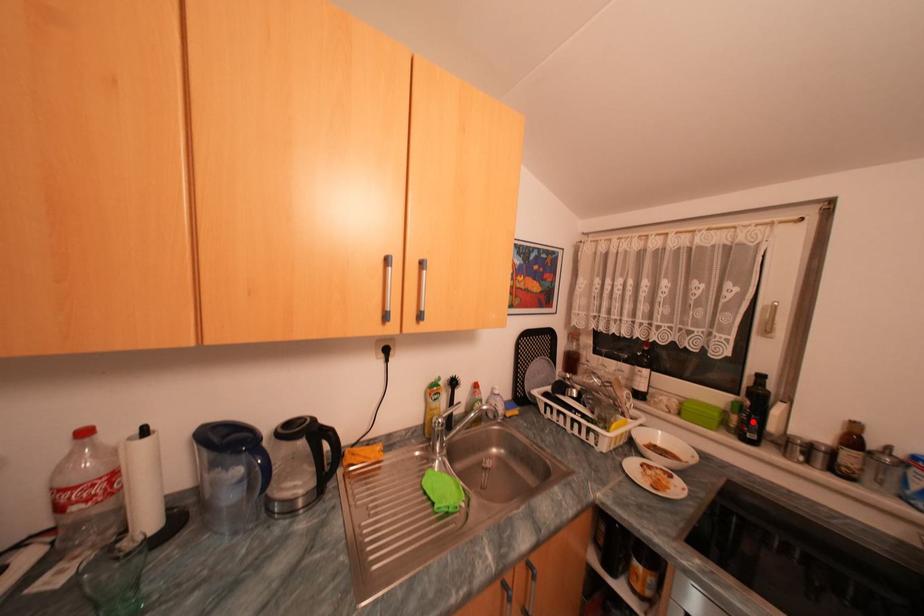
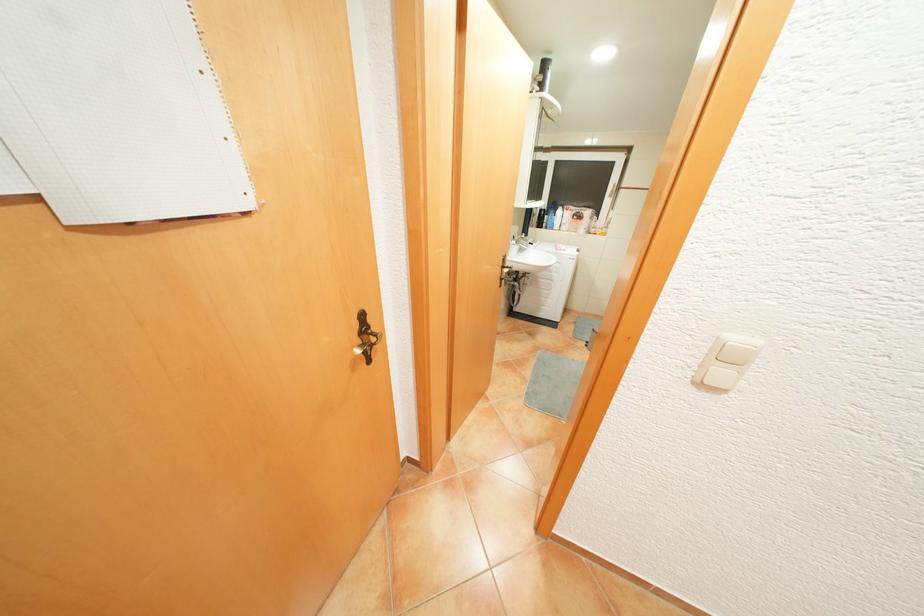
Question: I am providing you with two images of the same scene from different viewpoints. A red point is marked on the first image. At the location where the point appears in image 1, is it still visible in image 2?

Choices:
 (A) Yes
 (B) No

Answer: (B)